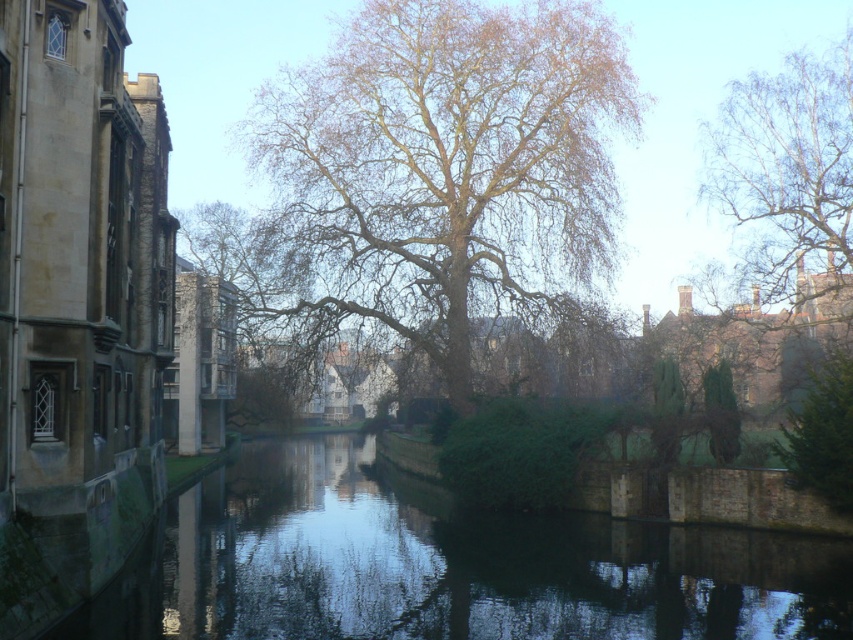
You are a tourist standing on the right bank of the canal. You want to take a photo of the dark green water at center and the white textured bark at upper right in the same frame. Which object should you position closer to the left side of your camera viewfinder to include both?

To include both the dark green water at center and the white textured bark at upper right in the same frame, you should position the dark green water at center closer to the left side of your camera viewfinder since it is already located to the left of the white textured bark at upper right.

You are a photographer wanting to capture the entire view of the bare branches tree at center and dark green water at center in one shot. Considering their sizes, which object would require you to adjust your camera angle more to include it fully in the frame?

The bare branches tree at center is much taller than the dark green water at center, so you would need to adjust your camera angle more to include the entire tree in the frame.